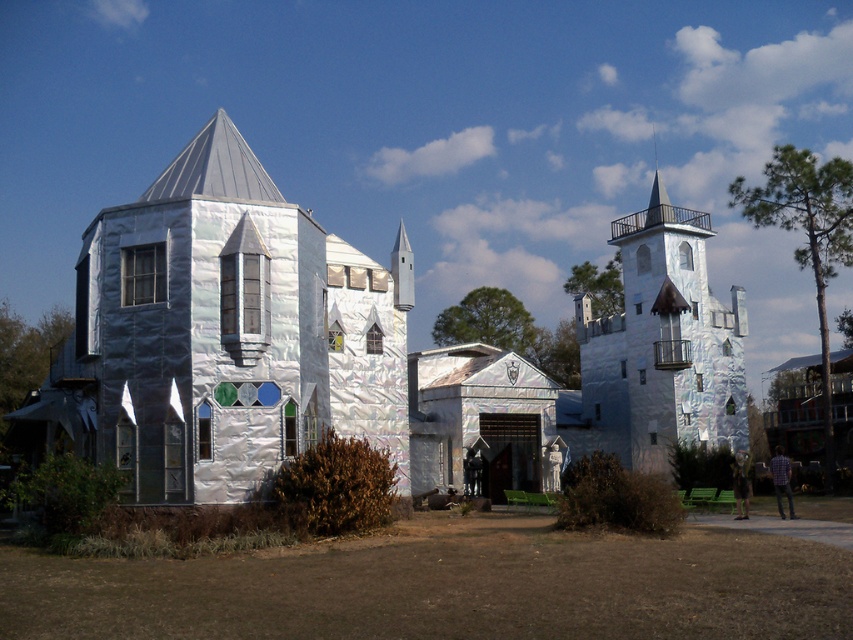
Question: Which of the following is the closest to the observer?

Choices:
 (A) silver foil castle at center
 (B) shiny silver castle at upper right

Answer: (A)

Question: Does silver foil castle at center have a larger size compared to shiny silver castle at upper right?

Choices:
 (A) no
 (B) yes

Answer: (B)

Question: Does silver foil castle at center come behind shiny silver castle at upper right?

Choices:
 (A) yes
 (B) no

Answer: (B)

Question: Among these objects, which one is nearest to the camera?

Choices:
 (A) silver foil castle at center
 (B) shiny silver castle at upper right

Answer: (A)

Question: Where is silver foil castle at center located in relation to shiny silver castle at upper right in the image?

Choices:
 (A) right
 (B) left

Answer: (B)